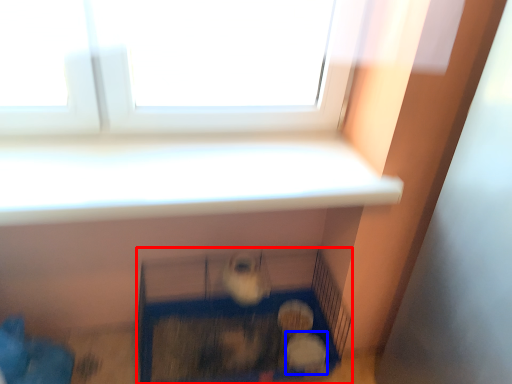
Question: Which of the following is the closest to the observer, furniture (highlighted by a red box) or animal (highlighted by a blue box)?

Choices:
 (A) furniture
 (B) animal

Answer: (A)